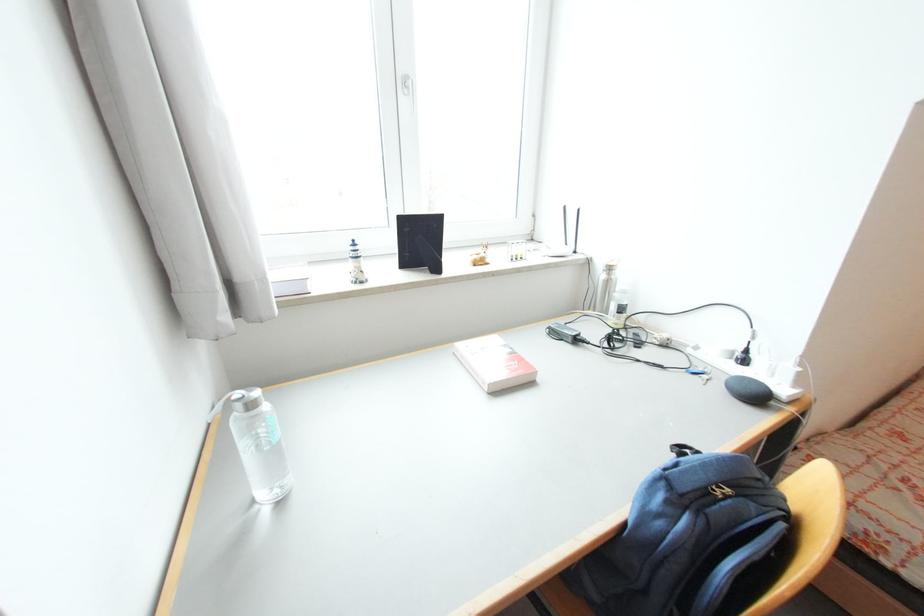
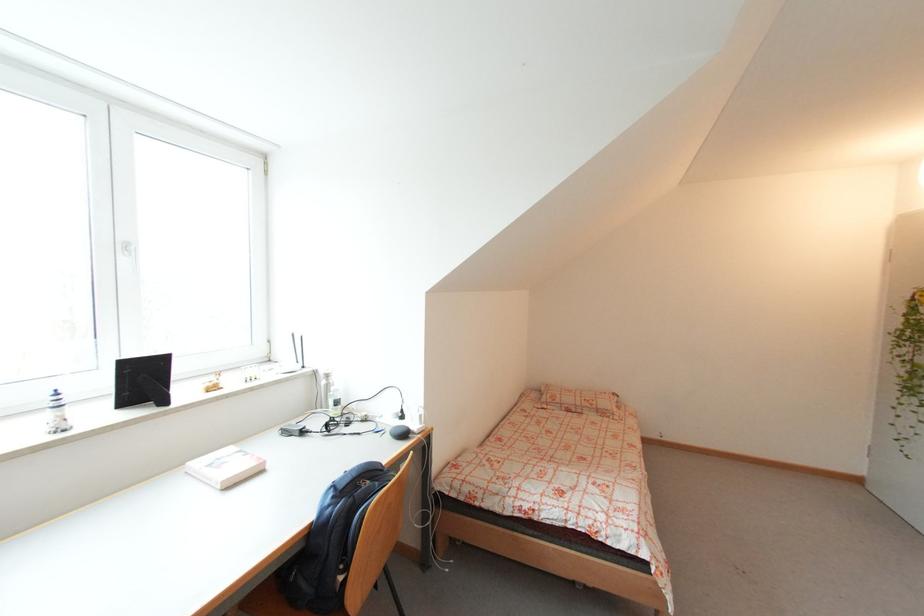
Find the pixel in the second image that matches point 357,243 in the first image.

(58, 392)